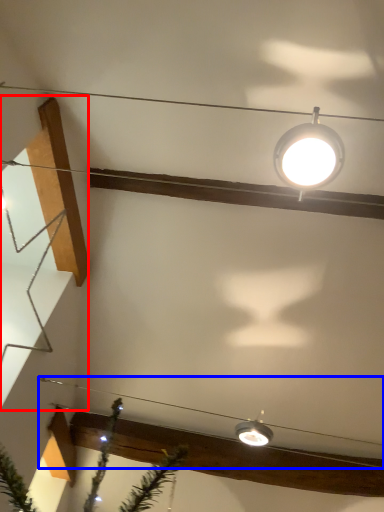
Question: Which of the following is the closest to the observer, stairwell (highlighted by a red box) or wire (highlighted by a blue box)?

Choices:
 (A) stairwell
 (B) wire

Answer: (A)